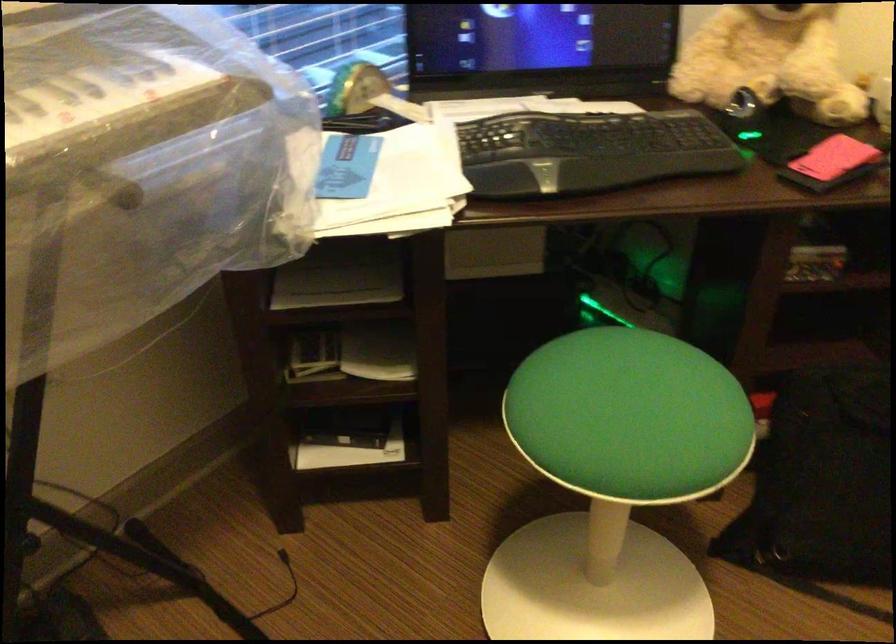
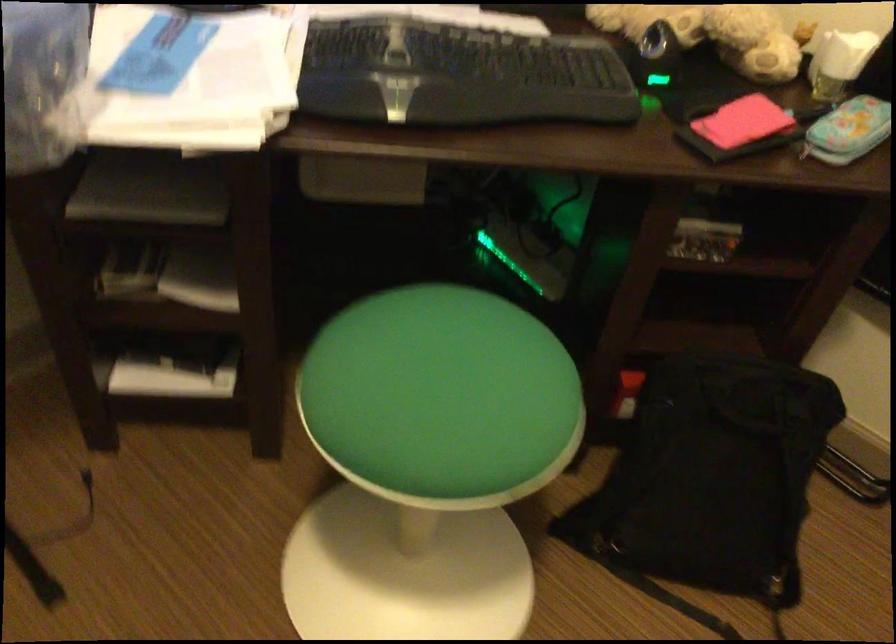
Question: The images are taken continuously from a first-person perspective. In which direction is your viewpoint rotating?

Choices:
 (A) Left
 (B) Right
 (C) Up
 (D) Down

Answer: (D)